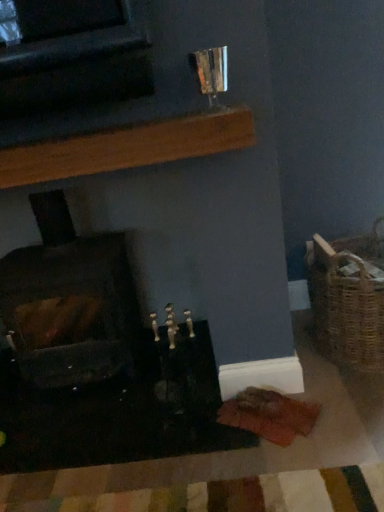
Where is `free location in front of dark brown wood at left`? free location in front of dark brown wood at left is located at coordinates (83, 447).